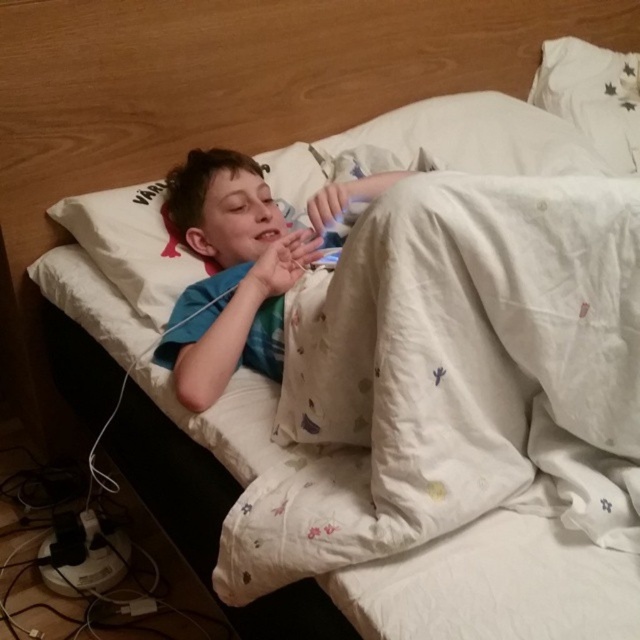
Who is positioned more to the left, white cotton pillow at upper left or white cotton pillow at upper right?

white cotton pillow at upper left

Does white cotton pillow at upper left have a lesser width compared to white cotton pillow at upper right?

In fact, white cotton pillow at upper left might be wider than white cotton pillow at upper right.

Describe the element at coordinates (440, 144) in the screenshot. I see `white cotton pillow at upper left` at that location.

What are the coordinates of `white cotton pillow at upper left` in the screenshot? It's located at (440, 144).

Is blue cotton shirt at center shorter than white cotton pillow at upper right?

No.

Is blue cotton shirt at center positioned at the back of white cotton pillow at upper right?

No, it is in front of white cotton pillow at upper right.

Between point (252, 230) and point (618, 172), which one is positioned in front?

Point (252, 230) is more forward.

I want to click on blue cotton shirt at center, so click(244, 264).

Which of these two, white cotton pillow at upper left or blue cotton shirt at center, stands taller?

blue cotton shirt at center

Does white cotton pillow at upper left have a larger size compared to blue cotton shirt at center?

Correct, white cotton pillow at upper left is larger in size than blue cotton shirt at center.

Between point (468, 132) and point (352, 186), which one is positioned in front?

Point (352, 186)

Locate an element on the screen. The image size is (640, 640). white cotton pillow at upper left is located at coordinates (440, 144).